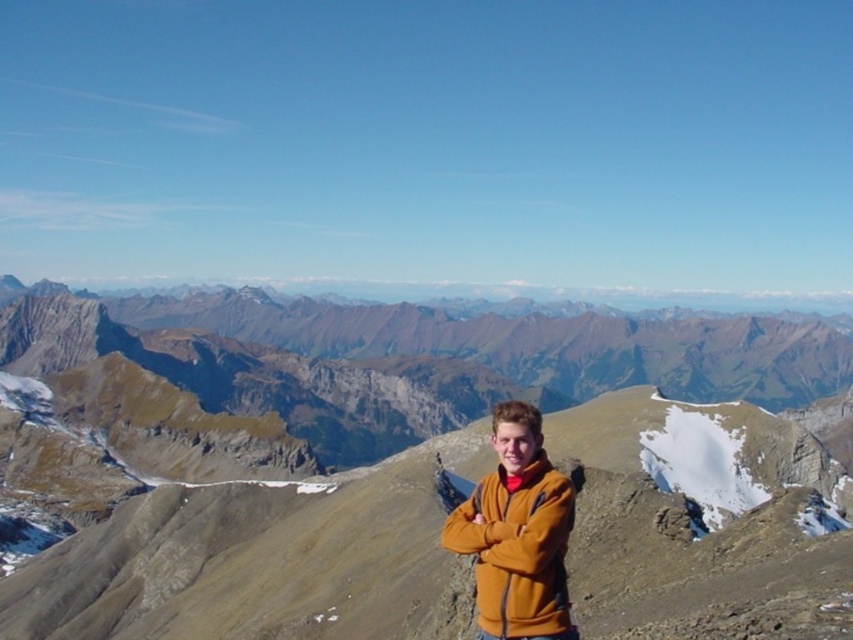
You are a hiker planning to take a photo of the brown rocky mountain at center from the current position. Is the mountain within your camera frame?

The brown rocky mountain at center is located at point coordinates of (x=368, y=490), which is within the camera frame.

You are a hiker trying to take a photo of the brown rocky mountain at center while wearing the orange fleece jacket at center. Can you position yourself so that the jacket is visible in the photo without being blocked by the mountain?

The orange fleece jacket at center is behind the brown rocky mountain at center, so it would be blocked from view. To take a photo where the jacket is visible without being blocked, you would need to move so that the jacket is positioned in front of the mountain or to the side.